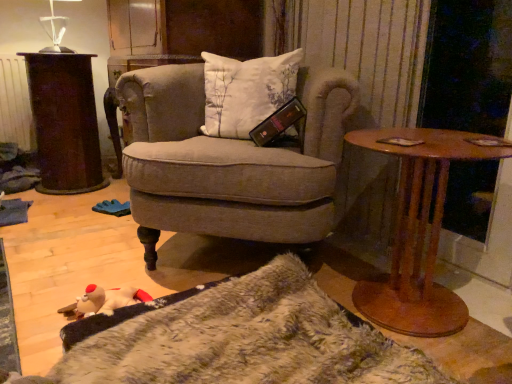
Question: Can you confirm if brown wooden table at right is taller than rusty metal trash can at left?

Choices:
 (A) no
 (B) yes

Answer: (A)

Question: Is brown wooden table at right shorter than rusty metal trash can at left?

Choices:
 (A) no
 (B) yes

Answer: (B)

Question: Can you confirm if brown wooden table at right is wider than rusty metal trash can at left?

Choices:
 (A) no
 (B) yes

Answer: (B)

Question: Does brown wooden table at right have a lesser width compared to rusty metal trash can at left?

Choices:
 (A) yes
 (B) no

Answer: (B)

Question: From the image's perspective, is brown wooden table at right below rusty metal trash can at left?

Choices:
 (A) no
 (B) yes

Answer: (B)

Question: From the image's perspective, is brown wooden table at right positioned above or below textured beige armchair at center?

Choices:
 (A) above
 (B) below

Answer: (B)

Question: In terms of width, does brown wooden table at right look wider or thinner when compared to textured beige armchair at center?

Choices:
 (A) wide
 (B) thin

Answer: (B)

Question: Choose the correct answer: Is brown wooden table at right inside textured beige armchair at center or outside it?

Choices:
 (A) outside
 (B) inside

Answer: (A)

Question: Based on their positions, is brown wooden table at right located to the left or right of textured beige armchair at center?

Choices:
 (A) right
 (B) left

Answer: (A)

Question: Is rusty metal trash can at left spatially inside transparent glass table lamp at upper left, or outside of it?

Choices:
 (A) outside
 (B) inside

Answer: (A)

Question: From a real-world perspective, is rusty metal trash can at left physically located above or below transparent glass table lamp at upper left?

Choices:
 (A) above
 (B) below

Answer: (B)

Question: From their relative heights in the image, would you say rusty metal trash can at left is taller or shorter than transparent glass table lamp at upper left?

Choices:
 (A) short
 (B) tall

Answer: (B)

Question: Does point (95, 122) appear closer or farther from the camera than point (56, 39)?

Choices:
 (A) farther
 (B) closer

Answer: (B)

Question: In terms of size, does rusty metal trash can at left appear bigger or smaller than brown wooden table at right?

Choices:
 (A) small
 (B) big

Answer: (B)

Question: Is rusty metal trash can at left to the left or to the right of brown wooden table at right in the image?

Choices:
 (A) right
 (B) left

Answer: (B)